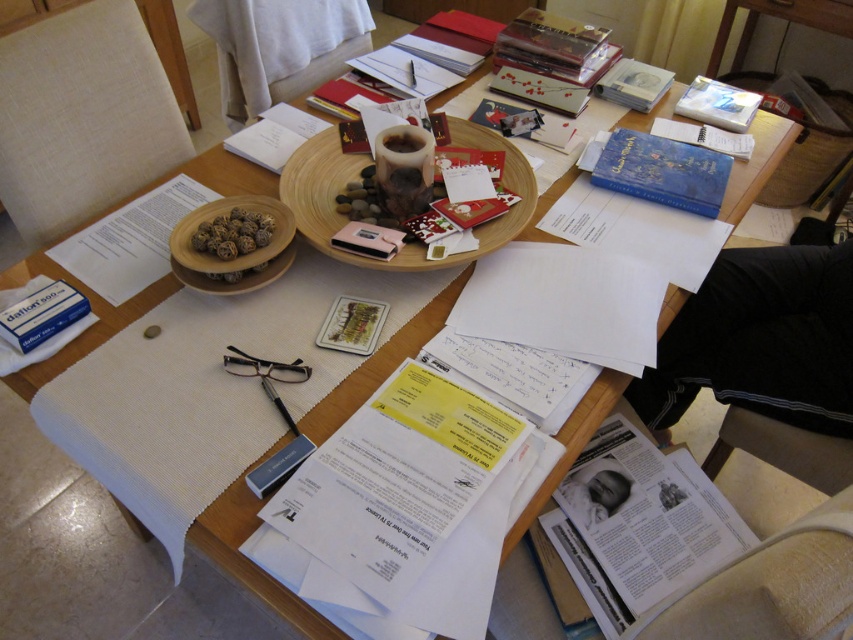
You are organizing the items on the table and notice the pink matte wallet at center and the red matte card at center. Which object is taller?

The pink matte wallet at center is taller than the red matte card at center.

You are organizing items on the table and need to place a new item between the white matte box at lower left and the wooden textured card at center. Where should you place it?

You should place the new item between the white matte box at lower left and the wooden textured card at center, as the white matte box is to the left of the wooden textured card.